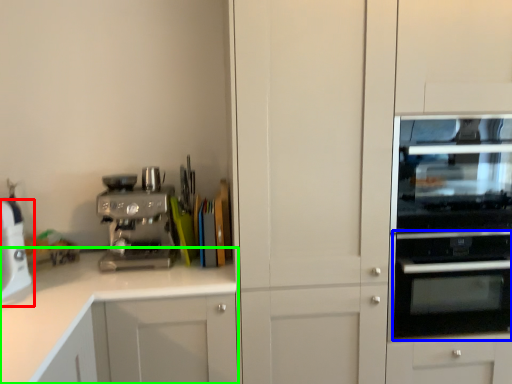
Question: Which is nearer to the home appliance (highlighted by a red box)? oven (highlighted by a blue box) or cabinetry (highlighted by a green box).

Choices:
 (A) oven
 (B) cabinetry

Answer: (B)